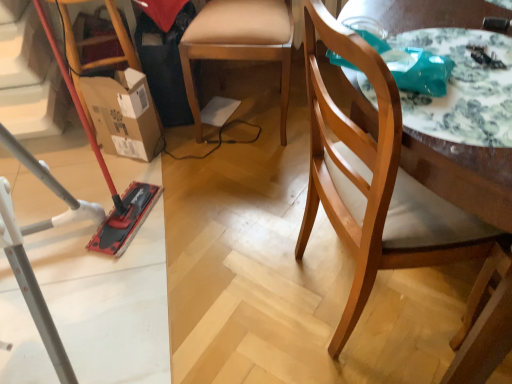
Where is `vacant location below light brown wooden chair at center, the 2th chair in the front-to-back sequence (from a real-world perspective)`? vacant location below light brown wooden chair at center, the 2th chair in the front-to-back sequence (from a real-world perspective) is located at coordinates (242, 124).